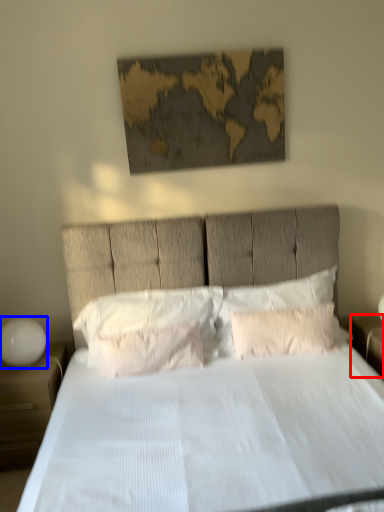
Question: Which object appears closest to the camera in this image, nightstand (highlighted by a red box) or bedside lamp (highlighted by a blue box)?

Choices:
 (A) nightstand
 (B) bedside lamp

Answer: (B)